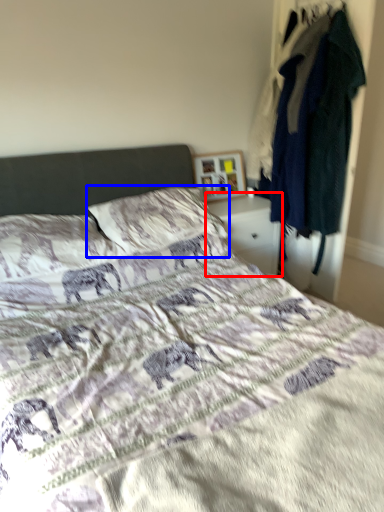
Question: Which of the following is the farthest to the observer, nightstand (highlighted by a red box) or pillow (highlighted by a blue box)?

Choices:
 (A) nightstand
 (B) pillow

Answer: (A)